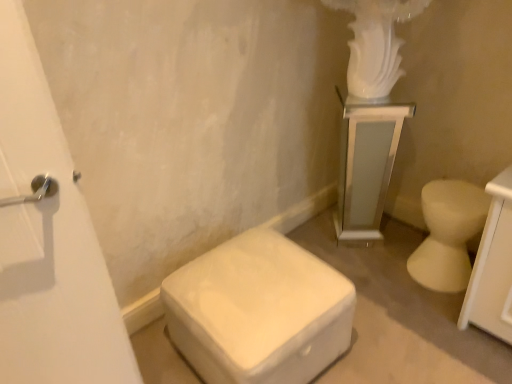
The height and width of the screenshot is (384, 512). What do you see at coordinates (259, 311) in the screenshot?
I see `white matte ottoman at lower center, which ranks as the first toilet in left-to-right order` at bounding box center [259, 311].

The width and height of the screenshot is (512, 384). What do you see at coordinates (448, 234) in the screenshot?
I see `white glossy toilet at right, which is the 1th toilet from right to left` at bounding box center [448, 234].

The width and height of the screenshot is (512, 384). I want to click on white glossy pedestal at upper right, so click(x=366, y=166).

Where is `white matte ottoman at lower center, which ranks as the first toilet in left-to-right order`? Image resolution: width=512 pixels, height=384 pixels. white matte ottoman at lower center, which ranks as the first toilet in left-to-right order is located at coordinates (259, 311).

Based on the photo, which object is positioned more to the right, white matte ottoman at lower center, which ranks as the 2th toilet in right-to-left order, or white glossy pedestal at upper right?

white glossy pedestal at upper right is more to the right.

Is white matte ottoman at lower center, which ranks as the 2th toilet in right-to-left order, taller than white glossy pedestal at upper right?

No, white matte ottoman at lower center, which ranks as the 2th toilet in right-to-left order, is not taller than white glossy pedestal at upper right.

Is white matte ottoman at lower center, which ranks as the first toilet in left-to-right order, positioned beyond the bounds of white glossy pedestal at upper right?

Yes.

Does white glossy pedestal at upper right turn towards white matte ottoman at lower center, which ranks as the 2th toilet in right-to-left order?

No, white glossy pedestal at upper right is not turned towards white matte ottoman at lower center, which ranks as the 2th toilet in right-to-left order.

Does white glossy pedestal at upper right have a lesser width compared to white matte ottoman at lower center, which ranks as the first toilet in left-to-right order?

Yes, white glossy pedestal at upper right is thinner than white matte ottoman at lower center, which ranks as the first toilet in left-to-right order.

Is white glossy pedestal at upper right shorter than white matte ottoman at lower center, which ranks as the first toilet in left-to-right order?

No, white glossy pedestal at upper right is not shorter than white matte ottoman at lower center, which ranks as the first toilet in left-to-right order.

Is the surface of white glossy pedestal at upper right in direct contact with white matte ottoman at lower center, which ranks as the 2th toilet in right-to-left order?

No.

Considering the sizes of objects white matte ottoman at lower center, which ranks as the first toilet in left-to-right order, and white glossy toilet at right, which is the 1th toilet from right to left, in the image provided, who is bigger, white matte ottoman at lower center, which ranks as the first toilet in left-to-right order, or white glossy toilet at right, which is the 1th toilet from right to left,?

white matte ottoman at lower center, which ranks as the first toilet in left-to-right order.

Is white glossy toilet at right, which is the 1th toilet from right to left, at the back of white matte ottoman at lower center, which ranks as the 2th toilet in right-to-left order?

That's not correct — white matte ottoman at lower center, which ranks as the 2th toilet in right-to-left order, is not looking away from white glossy toilet at right, which is the 1th toilet from right to left.

In terms of width, does white matte ottoman at lower center, which ranks as the 2th toilet in right-to-left order, look wider or thinner when compared to white glossy toilet at right, the 2th toilet positioned from the left?

white matte ottoman at lower center, which ranks as the 2th toilet in right-to-left order, is wider than white glossy toilet at right, the 2th toilet positioned from the left.

Consider the image. Are white glossy toilet at right, which is the 1th toilet from right to left, and white glossy pedestal at upper right located far from each other?

They are positioned close to each other.

This screenshot has height=384, width=512. I want to click on the 2nd toilet located beneath the white glossy pedestal at upper right (from a real-world perspective), so pyautogui.click(x=448, y=234).

In the scene shown: How many degrees apart are the facing directions of white glossy toilet at right, which is the 1th toilet from right to left, and white glossy pedestal at upper right?

They differ by 43.1 degrees in their facing directions.

Is white glossy toilet at right, the 2th toilet positioned from the left, turned away from white matte ottoman at lower center, which ranks as the 2th toilet in right-to-left order?

white glossy toilet at right, the 2th toilet positioned from the left, is not turned away from white matte ottoman at lower center, which ranks as the 2th toilet in right-to-left order.

Consider the image. From a real-world perspective, is white glossy toilet at right, which is the 1th toilet from right to left, beneath white matte ottoman at lower center, which ranks as the 2th toilet in right-to-left order?

Correct, in the physical world, white glossy toilet at right, which is the 1th toilet from right to left, is lower than white matte ottoman at lower center, which ranks as the 2th toilet in right-to-left order.

Which of these two, white glossy toilet at right, the 2th toilet positioned from the left, or white matte ottoman at lower center, which ranks as the 2th toilet in right-to-left order, is bigger?

Bigger between the two is white matte ottoman at lower center, which ranks as the 2th toilet in right-to-left order.

How far apart are white glossy toilet at right, the 2th toilet positioned from the left, and white matte ottoman at lower center, which ranks as the first toilet in left-to-right order?

white glossy toilet at right, the 2th toilet positioned from the left, is 30.60 inches away from white matte ottoman at lower center, which ranks as the first toilet in left-to-right order.

Considering their positions, is white glossy pedestal at upper right located in front of or behind white glossy toilet at right, the 2th toilet positioned from the left?

Visually, white glossy pedestal at upper right is located behind white glossy toilet at right, the 2th toilet positioned from the left.

From the image's perspective, is white glossy pedestal at upper right above or below white glossy toilet at right, the 2th toilet positioned from the left?

white glossy pedestal at upper right is situated higher than white glossy toilet at right, the 2th toilet positioned from the left, in the image.

Considering the sizes of objects white glossy pedestal at upper right and white glossy toilet at right, the 2th toilet positioned from the left, in the image provided, who is thinner, white glossy pedestal at upper right or white glossy toilet at right, the 2th toilet positioned from the left,?

With smaller width is white glossy toilet at right, the 2th toilet positioned from the left.

Is white glossy pedestal at upper right looking in the opposite direction of white glossy toilet at right, which is the 1th toilet from right to left?

No.

Where is `medicine cabinet on the right of white matte ottoman at lower center, which ranks as the 2th toilet in right-to-left order`? The image size is (512, 384). medicine cabinet on the right of white matte ottoman at lower center, which ranks as the 2th toilet in right-to-left order is located at coordinates 366,166.

Locate an element on the screen. This screenshot has width=512, height=384. medicine cabinet positioned vertically above the white matte ottoman at lower center, which ranks as the first toilet in left-to-right order (from a real-world perspective) is located at coordinates (366, 166).

Which object lies nearer to the anchor point white glossy pedestal at upper right, white matte ottoman at lower center, which ranks as the first toilet in left-to-right order, or white glossy toilet at right, the 2th toilet positioned from the left?

Among the two, white glossy toilet at right, the 2th toilet positioned from the left, is located nearer to white glossy pedestal at upper right.

Based on their spatial positions, is white glossy toilet at right, the 2th toilet positioned from the left, or white glossy pedestal at upper right further from white matte ottoman at lower center, which ranks as the first toilet in left-to-right order?

Among the two, white glossy pedestal at upper right is located further to white matte ottoman at lower center, which ranks as the first toilet in left-to-right order.

Looking at the image, which one is located closer to white glossy pedestal at upper right, white glossy toilet at right, the 2th toilet positioned from the left, or white matte ottoman at lower center, which ranks as the 2th toilet in right-to-left order?

Among the two, white glossy toilet at right, the 2th toilet positioned from the left, is located nearer to white glossy pedestal at upper right.

Considering their positions, is white glossy pedestal at upper right positioned further to white glossy toilet at right, the 2th toilet positioned from the left, than white matte ottoman at lower center, which ranks as the first toilet in left-to-right order?

white matte ottoman at lower center, which ranks as the first toilet in left-to-right order.

Looking at the image, which one is located closer to white matte ottoman at lower center, which ranks as the first toilet in left-to-right order, white glossy pedestal at upper right or white glossy toilet at right, the 2th toilet positioned from the left?

Among the two, white glossy toilet at right, the 2th toilet positioned from the left, is located nearer to white matte ottoman at lower center, which ranks as the first toilet in left-to-right order.

Estimate the real-world distances between objects in this image. Which object is closer to white glossy toilet at right, the 2th toilet positioned from the left, white matte ottoman at lower center, which ranks as the first toilet in left-to-right order, or white glossy pedestal at upper right?

white glossy pedestal at upper right.

What are the coordinates of `medicine cabinet between white matte ottoman at lower center, which ranks as the 2th toilet in right-to-left order, and white glossy toilet at right, which is the 1th toilet from right to left` in the screenshot? It's located at (366, 166).